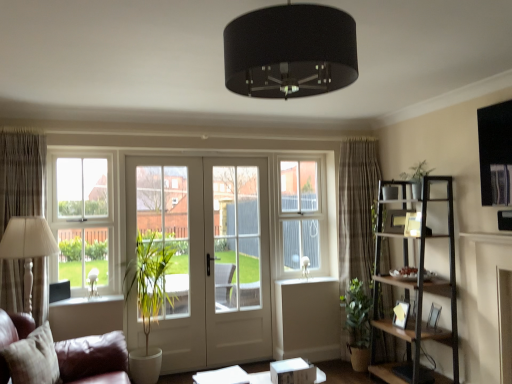
Question: Is wooden picture frame at right, the 2th picture frame positioned from the top, taller or shorter than white plastic window screen at center?

Choices:
 (A) tall
 (B) short

Answer: (B)

Question: Considering the positions of wooden picture frame at right, the 2th picture frame when ordered from bottom to top, and white plastic window screen at center in the image, is wooden picture frame at right, the 2th picture frame when ordered from bottom to top, wider or thinner than white plastic window screen at center?

Choices:
 (A) thin
 (B) wide

Answer: (B)

Question: Which of these objects is positioned closest to the green leafy plant in pot at lower right?

Choices:
 (A) white glossy picture frame at right, the third picture frame positioned from the top
 (B) plaid fabric curtain at right, the second curtain from the front
 (C) white glass window at upper left
 (D) white glass screen door at center
 (E) white plastic window screen at center

Answer: (A)

Question: Based on their relative distances, which object is farther from the wooden picture frame at right, the 2th picture frame positioned from the top?

Choices:
 (A) beige textured curtain at left, which appears as the 1th curtain when viewed from the left
 (B) white glossy window sill at center
 (C) dark brown wooden shelf at right
 (D) beige fabric pillow at lower left
 (E) white glossy picture frame at right, the third picture frame positioned from the top

Answer: (A)